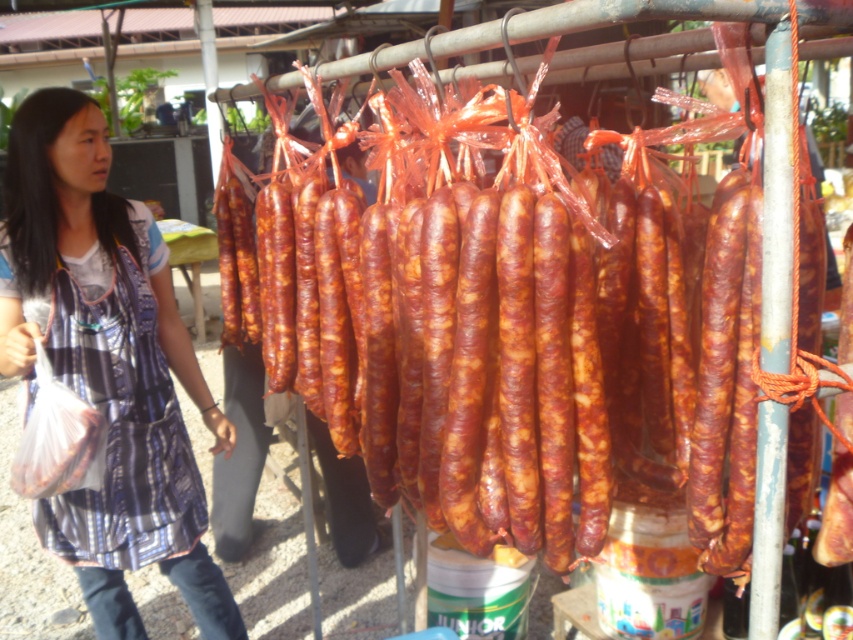
Question: Is brown glossy sausages at center smaller than plaid fabric dress at left?

Choices:
 (A) no
 (B) yes

Answer: (A)

Question: Which of the following is the farthest from the observer?

Choices:
 (A) (64, 257)
 (B) (561, 195)

Answer: (A)

Question: Can you confirm if brown glossy sausages at center is thinner than plaid fabric dress at left?

Choices:
 (A) no
 (B) yes

Answer: (A)

Question: Among these points, which one is nearest to the camera?

Choices:
 (A) (57, 304)
 (B) (265, 307)

Answer: (A)

Question: Is brown glossy sausages at center closer to camera compared to plaid fabric dress at left?

Choices:
 (A) no
 (B) yes

Answer: (B)